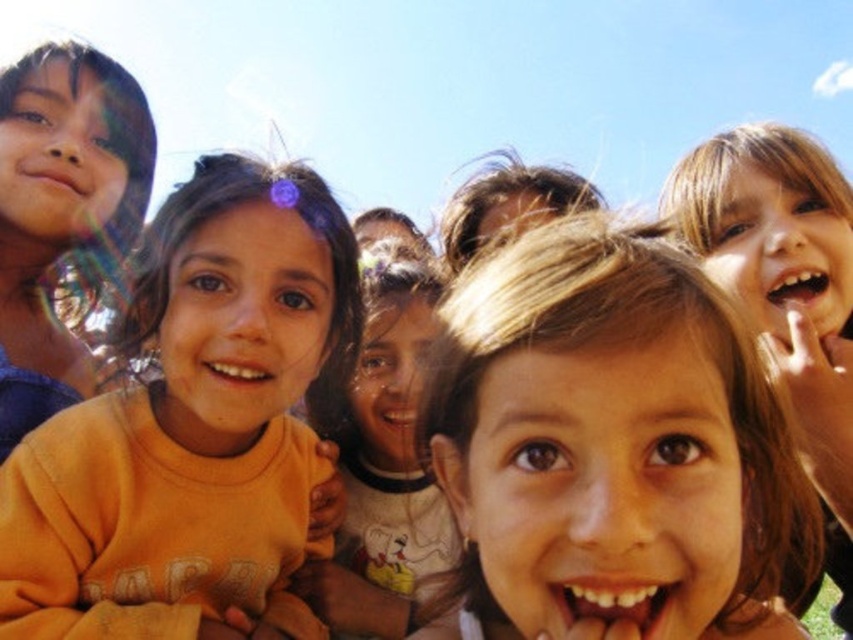
Question: Which object is closer to the camera taking this photo?

Choices:
 (A) blonde hair at center
 (B) orange cotton shirt at center

Answer: (A)

Question: Observing the image, what is the correct spatial positioning of blonde hair at center in reference to orange cotton shirt at center?

Choices:
 (A) right
 (B) left

Answer: (A)

Question: Which point appears farthest from the camera in this image?

Choices:
 (A) (113, 486)
 (B) (706, 556)

Answer: (A)

Question: Is blonde hair at center below orange cotton shirt at center?

Choices:
 (A) yes
 (B) no

Answer: (A)

Question: Can you confirm if blonde hair at center is positioned to the right of orange cotton shirt at center?

Choices:
 (A) yes
 (B) no

Answer: (A)